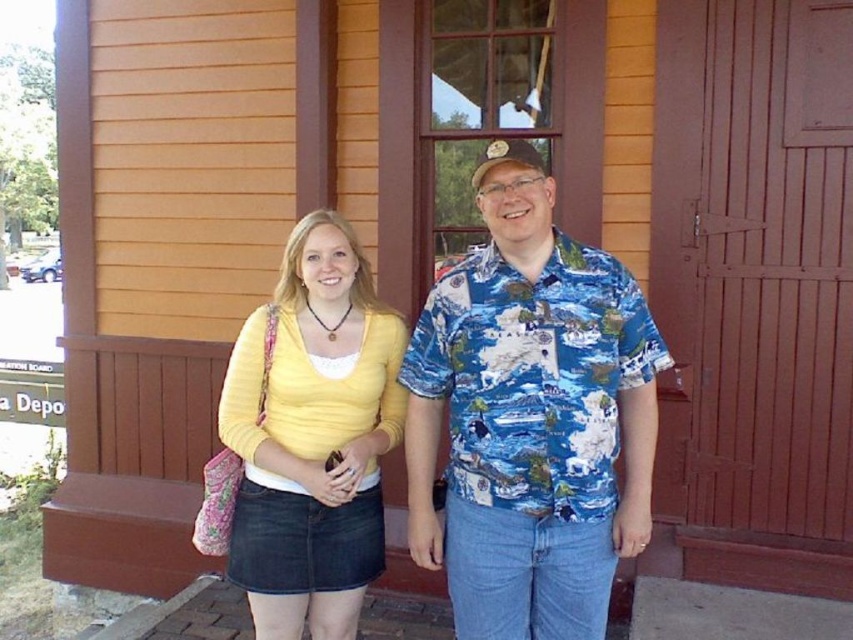
From the picture: Is blue printed shirt at center thinner than matte yellow sweater at center?

Incorrect, blue printed shirt at center's width is not less than matte yellow sweater at center's.

Which is below, blue printed shirt at center or matte yellow sweater at center?

matte yellow sweater at center is lower down.

Who is more distant from viewer, (651, 406) or (351, 588)?

The point (351, 588) is more distant.

The height and width of the screenshot is (640, 853). I want to click on blue printed shirt at center, so click(531, 417).